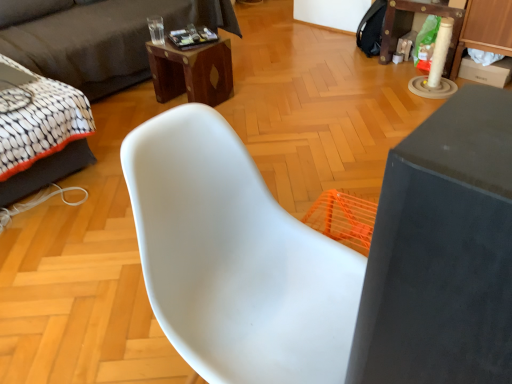
In order to face wooden table at upper right, which is the 1th table from top to bottom, should I rotate leftwards or rightwards?

Rotate your view right by about 22.371°.

The width and height of the screenshot is (512, 384). What do you see at coordinates (411, 26) in the screenshot?
I see `wooden table at upper right, the first table positioned from the right` at bounding box center [411, 26].

Identify the location of wooden desk at upper center. This screenshot has height=384, width=512. (192, 72).

Describe the element at coordinates (192, 72) in the screenshot. This screenshot has width=512, height=384. I see `wooden desk at upper center` at that location.

Find the location of a particular element. The width and height of the screenshot is (512, 384). matte gray table at right, the first table when ordered from bottom to top is located at coordinates (442, 252).

The height and width of the screenshot is (384, 512). In order to click on wooden table at upper right, placed as the 2th table when sorted from bottom to top in this screenshot , I will do `click(411, 26)`.

Where is `table below the dark gray fabric couch at upper left (from a real-world perspective)`? The image size is (512, 384). table below the dark gray fabric couch at upper left (from a real-world perspective) is located at coordinates (411, 26).

Is dark gray fabric couch at upper left wider than wooden table at upper right, acting as the second table starting from the front?

Yes.

Is dark gray fabric couch at upper left facing towards wooden table at upper right, which is the 1th table from top to bottom?

Yes, dark gray fabric couch at upper left faces towards wooden table at upper right, which is the 1th table from top to bottom.

Is dark gray fabric couch at upper left in front of wooden desk at upper center?

Yes, it is in front of wooden desk at upper center.

Is wooden desk at upper center at the back of dark gray fabric couch at upper left?

dark gray fabric couch at upper left is not turned away from wooden desk at upper center.

How many degrees apart are the facing directions of dark gray fabric couch at upper left and wooden desk at upper center?

The facing directions of dark gray fabric couch at upper left and wooden desk at upper center are 1.83 degrees apart.

Does dark gray fabric couch at upper left have a smaller size compared to white fabric bed at left?

No, dark gray fabric couch at upper left is not smaller than white fabric bed at left.

Considering the sizes of objects dark gray fabric couch at upper left and white fabric bed at left in the image provided, who is thinner, dark gray fabric couch at upper left or white fabric bed at left?

Thinner between the two is white fabric bed at left.

I want to click on bed in front of the dark gray fabric couch at upper left, so click(x=40, y=132).

Considering the relative sizes of dark gray fabric couch at upper left and white fabric bed at left in the image provided, is dark gray fabric couch at upper left shorter than white fabric bed at left?

No, dark gray fabric couch at upper left is not shorter than white fabric bed at left.

Who is shorter, wooden table at upper right, placed as the 2th table when sorted from bottom to top, or white plastic chair at center?

With less height is wooden table at upper right, placed as the 2th table when sorted from bottom to top.

From the image's perspective, is wooden table at upper right, the second table in the left-to-right sequence, located above white plastic chair at center?

Indeed, from the image's perspective, wooden table at upper right, the second table in the left-to-right sequence, is shown above white plastic chair at center.

Considering the relative positions of wooden table at upper right, which is counted as the 1th table, starting from the back, and white plastic chair at center in the image provided, is wooden table at upper right, which is counted as the 1th table, starting from the back, in front of white plastic chair at center?

No.

Does wooden table at upper right, which is counted as the 1th table, starting from the back, have a larger size compared to white plastic chair at center?

Incorrect, wooden table at upper right, which is counted as the 1th table, starting from the back, is not larger than white plastic chair at center.

Who is more distant, white fabric bed at left or dark gray fabric couch at upper left?

dark gray fabric couch at upper left is more distant.

Is point (61, 170) positioned after point (28, 27)?

No, (61, 170) is in front of (28, 27).

From the image's perspective, between white fabric bed at left and dark gray fabric couch at upper left, which one is located above?

dark gray fabric couch at upper left.

Does wooden table at upper right, acting as the second table starting from the front, come behind dark gray fabric couch at upper left?

Yes, it is.

Considering the sizes of objects wooden table at upper right, the first table positioned from the right, and dark gray fabric couch at upper left in the image provided, who is wider, wooden table at upper right, the first table positioned from the right, or dark gray fabric couch at upper left?

dark gray fabric couch at upper left.

Is wooden table at upper right, placed as the 2th table when sorted from bottom to top, far from dark gray fabric couch at upper left?

wooden table at upper right, placed as the 2th table when sorted from bottom to top, is far away from dark gray fabric couch at upper left.

Is wooden table at upper right, which is counted as the 1th table, starting from the back, inside or outside of dark gray fabric couch at upper left?

The correct answer is: outside.

From the image's perspective, does wooden desk at upper center appear lower than white plastic chair at center?

Actually, wooden desk at upper center appears above white plastic chair at center in the image.

Considering the relative sizes of wooden desk at upper center and white plastic chair at center in the image provided, is wooden desk at upper center smaller than white plastic chair at center?

Correct, wooden desk at upper center occupies less space than white plastic chair at center.

Locate an element on the screen. chair in front of the wooden desk at upper center is located at coordinates (234, 258).

From the dark gray fabric couch at upper left, count 2nd table to the right and point to it. Please provide its 2D coordinates.

[(411, 26)]

At what (x,y) coordinates should I click in order to perform the action: click on studio couch in front of the wooden desk at upper center. Please return your answer as a coordinate pair (x, y). Looking at the image, I should click on (98, 37).

From the image, which object appears to be nearer to white fabric bed at left, dark gray fabric couch at upper left or matte gray table at right, marked as the 2th table in a back-to-front arrangement?

dark gray fabric couch at upper left.

Which object lies further to the anchor point wooden desk at upper center, wooden table at upper right, acting as the second table starting from the front, or dark gray fabric couch at upper left?

wooden table at upper right, acting as the second table starting from the front, is further to wooden desk at upper center.

In the scene shown: Estimate the real-world distances between objects in this image. Which object is closer to wooden table at upper right, which is counted as the 1th table, starting from the back, white fabric bed at left or dark gray fabric couch at upper left?

dark gray fabric couch at upper left is closer to wooden table at upper right, which is counted as the 1th table, starting from the back.

Considering their positions, is white plastic chair at center positioned closer to matte gray table at right, which is the 2th table in top-to-bottom order, than wooden table at upper right, the first table positioned from the right?

Among the two, white plastic chair at center is located nearer to matte gray table at right, which is the 2th table in top-to-bottom order.

From the image, which object appears to be nearer to white fabric bed at left, wooden table at upper right, which is counted as the 1th table, starting from the back, or dark gray fabric couch at upper left?

dark gray fabric couch at upper left.

Looking at the image, which one is located further to dark gray fabric couch at upper left, wooden desk at upper center or white plastic chair at center?

white plastic chair at center.

Considering their positions, is wooden desk at upper center positioned closer to matte gray table at right, the 1th table in the front-to-back sequence, than wooden table at upper right, the first table positioned from the right?

wooden desk at upper center lies closer to matte gray table at right, the 1th table in the front-to-back sequence, than the other object.

Considering their positions, is white fabric bed at left positioned further to wooden table at upper right, the second table in the left-to-right sequence, than matte gray table at right, the 1th table in the front-to-back sequence?

Based on the image, matte gray table at right, the 1th table in the front-to-back sequence, appears to be further to wooden table at upper right, the second table in the left-to-right sequence.

Find the location of `studio couch between white plastic chair at center and wooden table at upper right, which is counted as the 1th table, starting from the back, from front to back`. studio couch between white plastic chair at center and wooden table at upper right, which is counted as the 1th table, starting from the back, from front to back is located at coordinates (98, 37).

Find the location of a particular element. The width and height of the screenshot is (512, 384). bed between matte gray table at right, the second table in the right-to-left sequence, and dark gray fabric couch at upper left from front to back is located at coordinates pyautogui.click(x=40, y=132).

Image resolution: width=512 pixels, height=384 pixels. I want to click on chair between matte gray table at right, which is the 2th table in top-to-bottom order, and wooden desk at upper center from front to back, so click(234, 258).

I want to click on bed between white plastic chair at center and wooden desk at upper center from front to back, so click(40, 132).